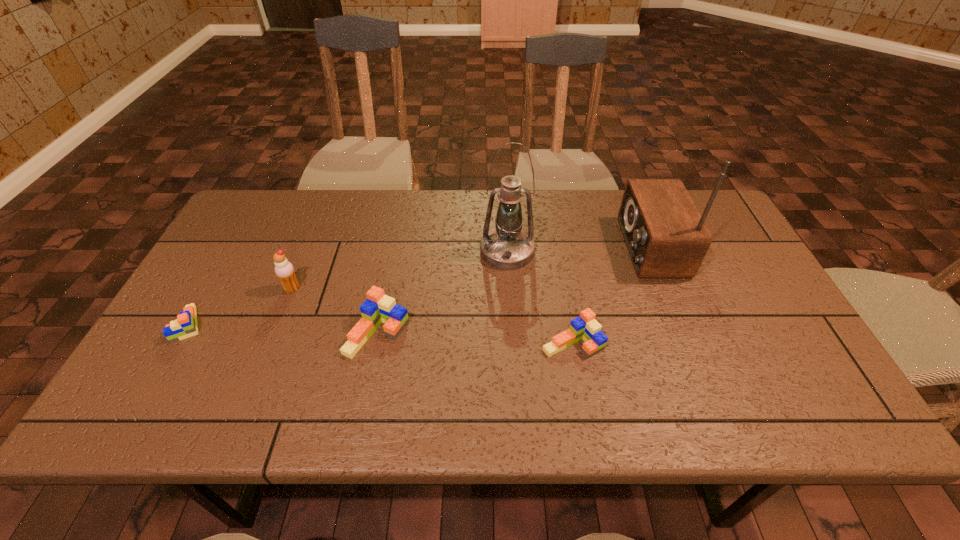
Where is `vacant region between the second Lego from left to right and the fifth object from right to left`? This screenshot has width=960, height=540. vacant region between the second Lego from left to right and the fifth object from right to left is located at coordinates (335, 311).

Locate an element on the screen. The width and height of the screenshot is (960, 540). empty space that is in between the shortest Lego and the oil lamp is located at coordinates (348, 288).

You are a GUI agent. You are given a task and a screenshot of the screen. Output one action in this format:
    pyautogui.click(x=<x>, y=<y>)
    Task: Click on the vacant area between the icecream and the second Lego from right to left
    The width and height of the screenshot is (960, 540).
    Given the screenshot: What is the action you would take?
    pyautogui.click(x=335, y=311)

Image resolution: width=960 pixels, height=540 pixels. I want to click on free space between the second shortest Lego and the oil lamp, so click(x=540, y=297).

Where is `vacant space that is in between the leftmost Lego and the second shortest object`? Image resolution: width=960 pixels, height=540 pixels. vacant space that is in between the leftmost Lego and the second shortest object is located at coordinates (381, 333).

Find the location of a particular element. Image resolution: width=960 pixels, height=540 pixels. vacant area between the leftmost Lego and the second shortest Lego is located at coordinates (381, 333).

The width and height of the screenshot is (960, 540). What are the coordinates of `empty space that is in between the rightmost object and the second object from left to right` in the screenshot? It's located at pos(471,268).

Locate an element on the screen. empty space between the radio receiver and the fifth object from right to left is located at coordinates (471, 268).

Image resolution: width=960 pixels, height=540 pixels. Find the location of `object that stands as the fifth closest to the fourth tallest object`. object that stands as the fifth closest to the fourth tallest object is located at coordinates (666, 236).

Find the location of a particular element. The width and height of the screenshot is (960, 540). object that ranks as the closest to the oil lamp is located at coordinates (585, 327).